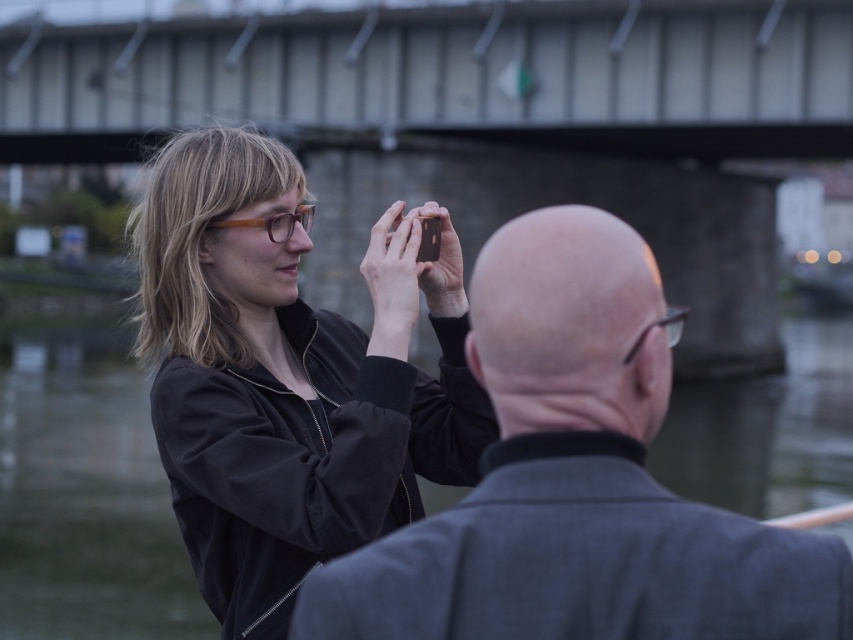
You are a photographer standing at the point marked as point (445, 456). You want to take a photo of the bald man wearing glasses and a dark jacket who is behind the woman with the camera. Can you capture him in your current position without moving?

The distance of point (445, 456) from the camera is 7.49 meters. Since the bald man is behind the woman with the camera, and you are at point (445, 456), you are positioned 7.49 meters away from the camera. This means the bald man is between you and the camera, so you cannot capture him without moving closer or adjusting your angle.

You are standing at the point marked by the coordinates point (286, 380). You want to take a photo of the bald man in the dark jacket. Can you see him clearly from your current position?

The point (286, 380) represents the matte black jacket at center, which is worn by the woman taking the photo. Since the bald man is behind her with his back turned, you cannot see him clearly from that position.

You are a photographer trying to capture the scene. The camera you are using has a lens that can focus on objects within a 1.5 meter range. The dark gray wool coat at center and the brown translucent glasses at upper center are both in your frame. Which object is more likely to be in focus if you focus on the closer object?

The brown translucent glasses at upper center is closer to the camera than the dark gray wool coat at center, so focusing on the closer object would put the brown translucent glasses at upper center in focus.